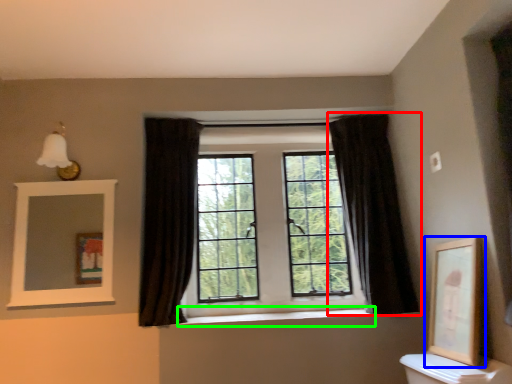
Question: Based on their relative distances, which object is nearer to curtain (highlighted by a red box)? Choose from picture frame (highlighted by a blue box) and window sill (highlighted by a green box).

Choices:
 (A) picture frame
 (B) window sill

Answer: (A)